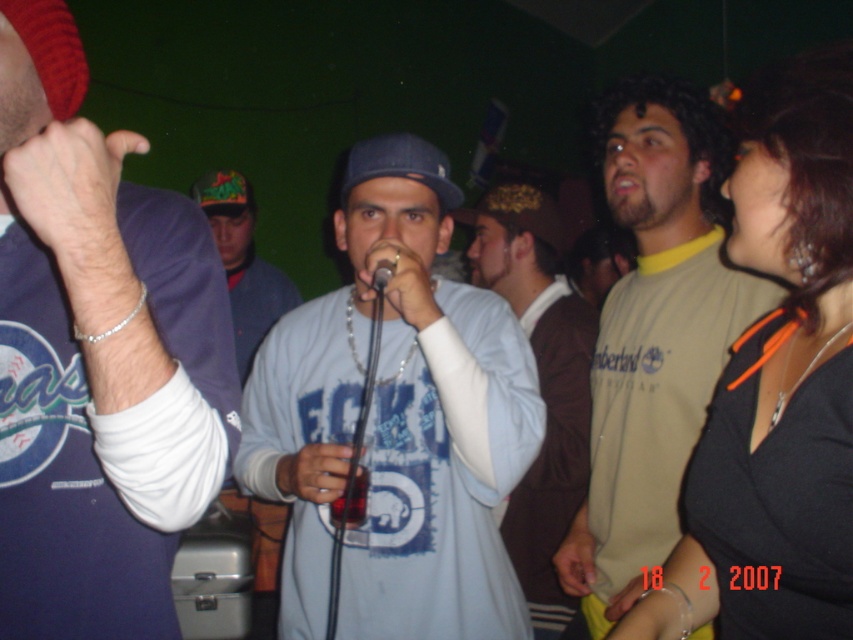
Question: Can you confirm if light blue cotton shirt at center is thinner than black metallic microphone at center?

Choices:
 (A) yes
 (B) no

Answer: (B)

Question: Can you confirm if brown leather jacket at center is positioned above black metallic microphone at center?

Choices:
 (A) yes
 (B) no

Answer: (B)

Question: Does light blue cotton shirt at center have a larger size compared to green fabric cap at center?

Choices:
 (A) yes
 (B) no

Answer: (A)

Question: Which point is closer to the camera?

Choices:
 (A) (234, 280)
 (B) (383, 288)
 (C) (618, 122)

Answer: (B)

Question: Based on their relative distances, which object is farther from the black metallic microphone at center?

Choices:
 (A) green fabric cap at center
 (B) matte blue sweatshirt at center

Answer: (A)

Question: Estimate the real-world distances between objects in this image. Which object is farther from the matte blue sweatshirt at center?

Choices:
 (A) light brown t-shirt at center
 (B) light blue cotton shirt at center

Answer: (A)